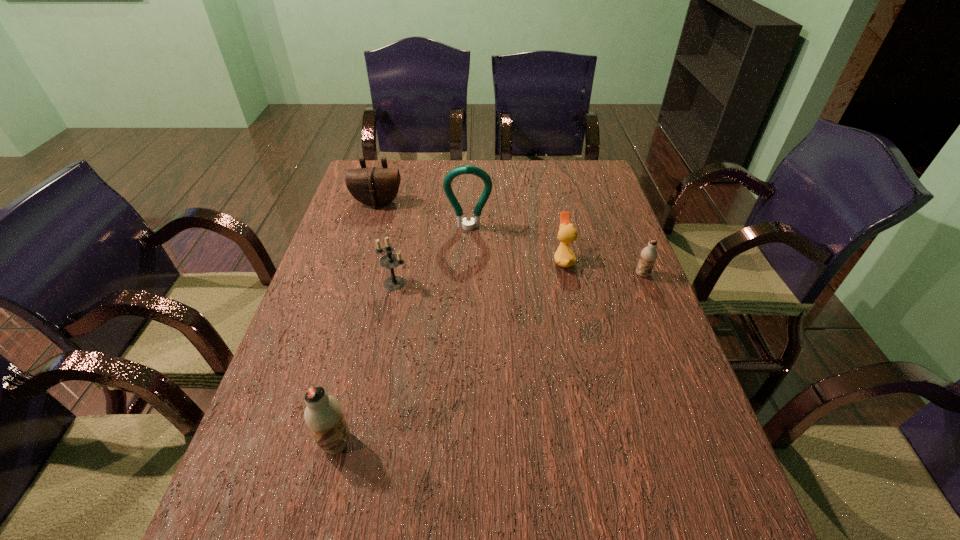
You are a GUI agent. You are given a task and a screenshot of the screen. Output one action in this format:
    pyautogui.click(x=<x>, y=<y>)
    Task: Click on the vacant space that satisfies the following two spatial constraints: 1. at the jaws of the tallest object; 2. on the right side of the shorter chocolate milk
    The width and height of the screenshot is (960, 540).
    Given the screenshot: What is the action you would take?
    pyautogui.click(x=468, y=274)